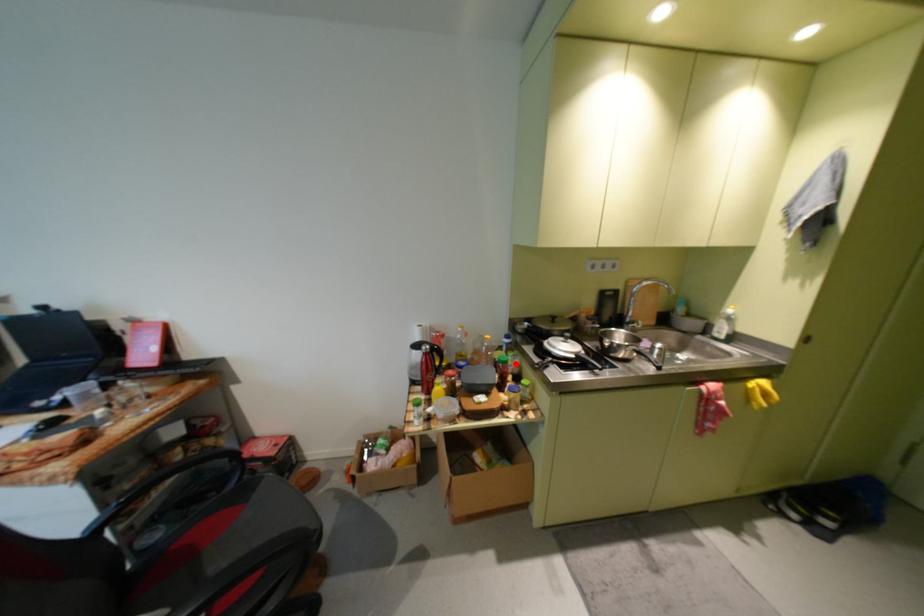
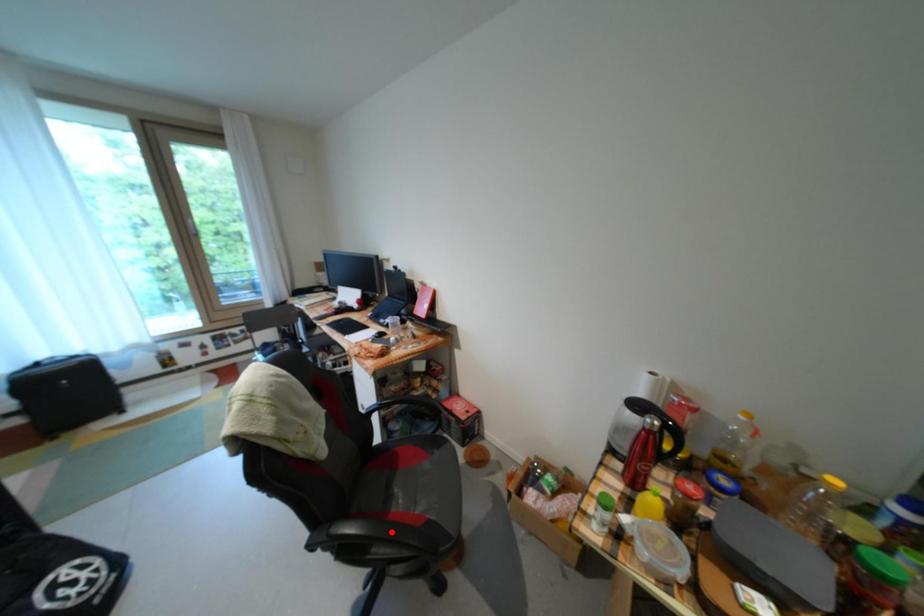
I am providing you with two images of the same scene from different viewpoints. A red point is marked on the first image and another point is marked on the second image. Do the highlighted points in image1 and image2 indicate the same real-world spot?

No